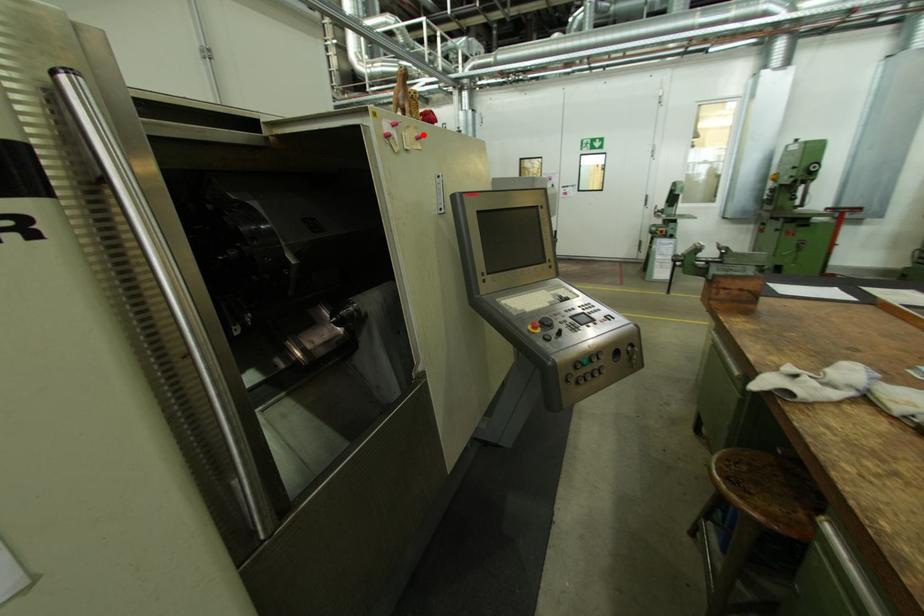
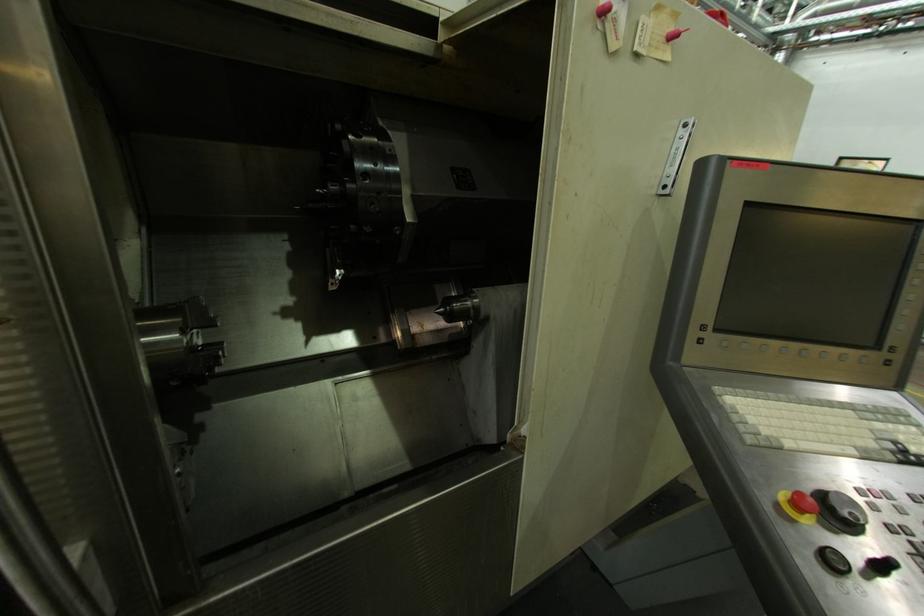
Locate, in the second image, the point that corresponds to the highlighted location in the first image.

(677, 30)